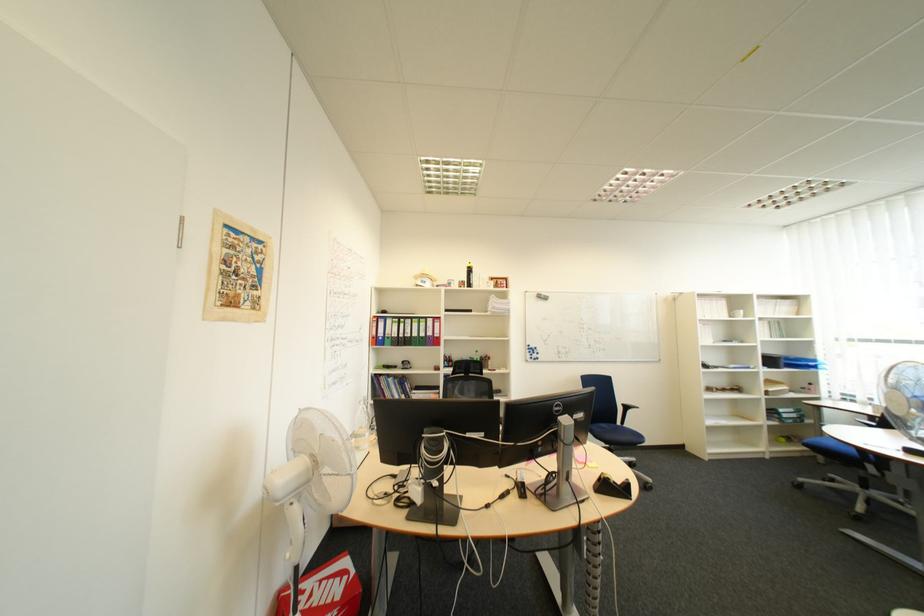
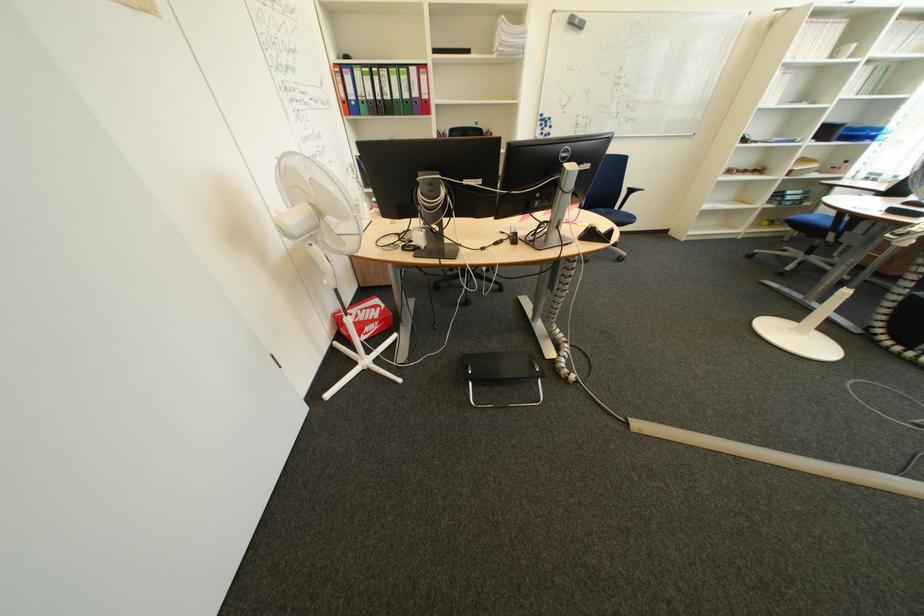
In the second image, find the point that corresponds to [561,499] in the first image.

(549, 244)